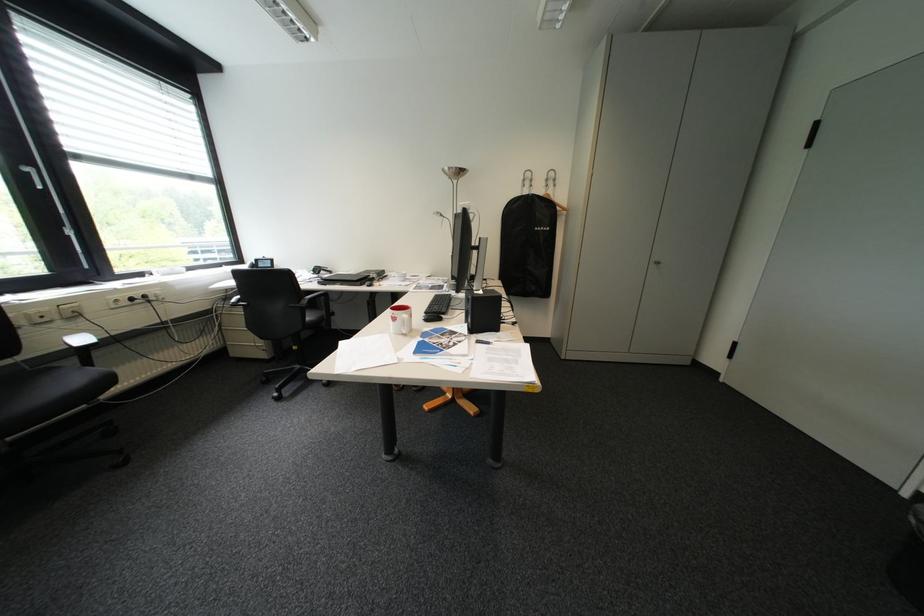
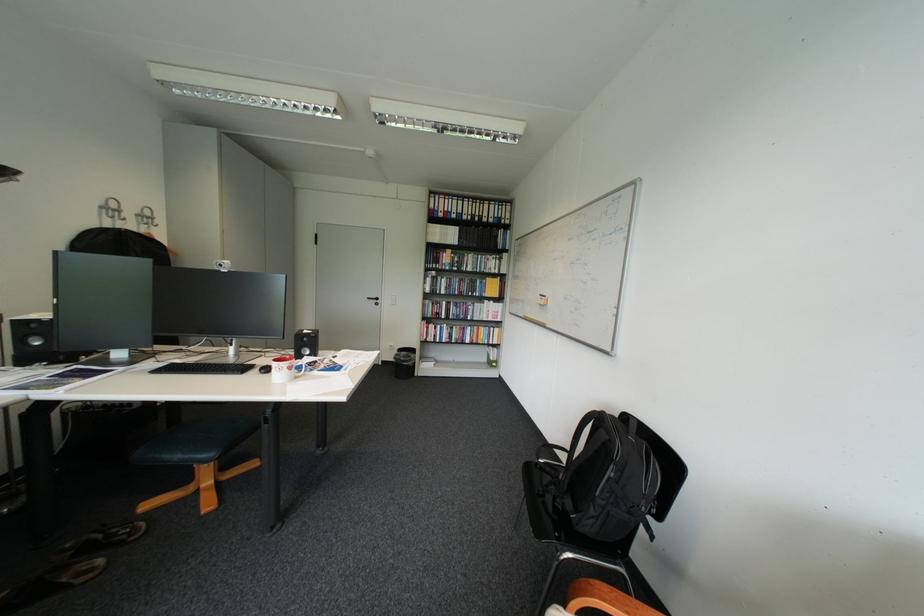
Question: I am providing you with two images of the same scene from different viewpoints. After the viewpoint changes to image2, which objects are now occluded?

Choices:
 (A) black backpack
 (B) colorful folded bag
 (C) black speaker
 (D) black chair sitting surface

Answer: (C)